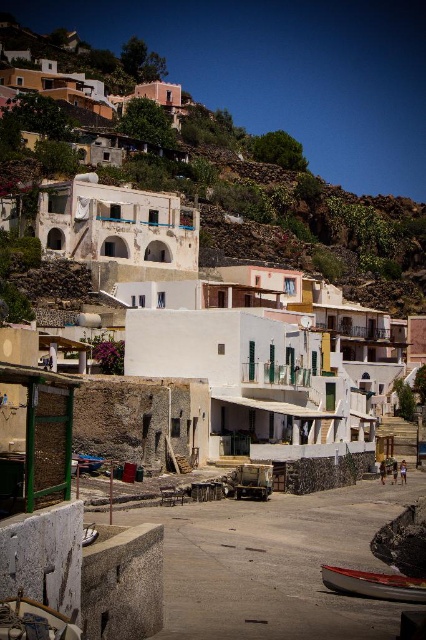
Can you confirm if white stucco houses at upper center is positioned below white wooden boat at lower right?

No.

Who is higher up, white stucco houses at upper center or white wooden boat at lower right?

white stucco houses at upper center is higher up.

Locate an element on the screen. This screenshot has height=640, width=426. white stucco houses at upper center is located at coordinates (294, 211).